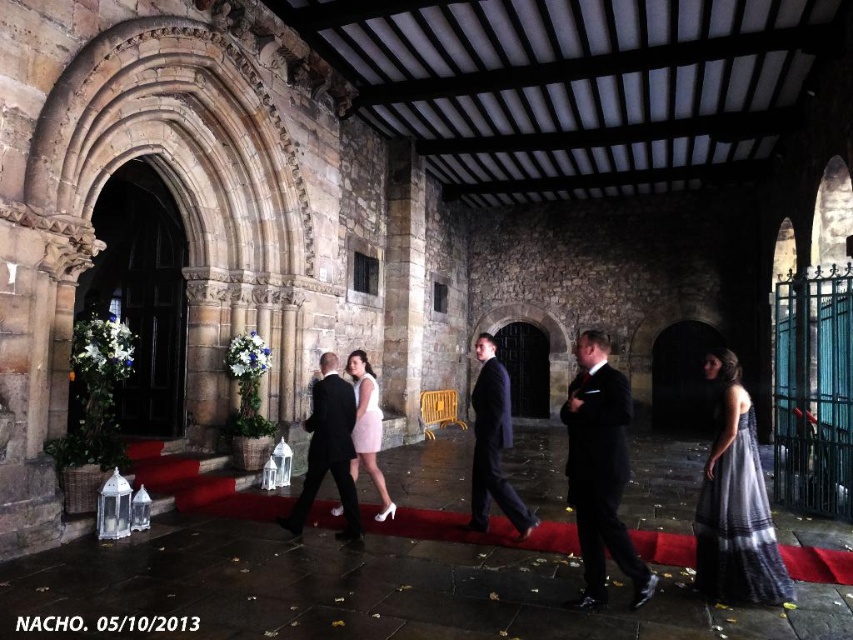
Can you confirm if shiny black suit at center is positioned to the right of pink satin dress at center?

Incorrect, shiny black suit at center is not on the right side of pink satin dress at center.

Measure the distance from shiny black suit at center to pink satin dress at center.

shiny black suit at center is 45.37 centimeters from pink satin dress at center.

Is point (317, 467) in front of point (380, 433)?

Yes, it is in front of point (380, 433).

Find the location of a particular element. The image size is (853, 640). shiny black suit at center is located at coordinates (328, 449).

Describe the element at coordinates (735, 515) in the screenshot. I see `gray striped fabric dress at right` at that location.

Between gray striped fabric dress at right and shiny black suit at center, which one is positioned higher?

shiny black suit at center is above.

Is point (704, 481) positioned after point (328, 470)?

No.

Identify the location of gray striped fabric dress at right. The image size is (853, 640). click(735, 515).

Which is behind, point (602, 573) or point (358, 388)?

Positioned behind is point (358, 388).

What do you see at coordinates (601, 470) in the screenshot?
I see `black satin suit at center` at bounding box center [601, 470].

Locate an element on the screen. Image resolution: width=853 pixels, height=640 pixels. black satin suit at center is located at coordinates (601, 470).